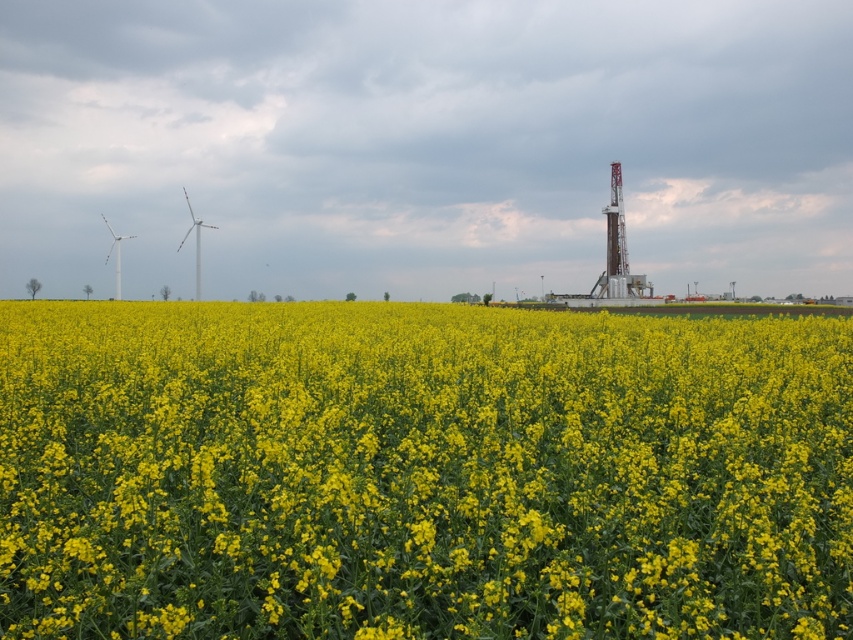
You are standing in the field of yellow flowers and want to take a photo. There are two points marked in the image. Which point is closer to you, point (228,310) or point (195,298)?

Point (228,310) is closer to you than point (195,298).